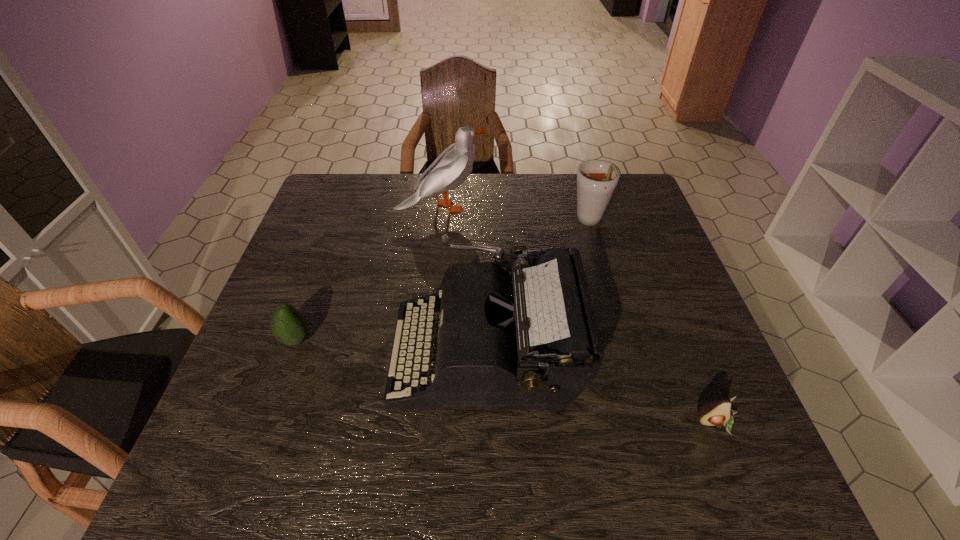
Where is `object that is the closest to the right avocado`? object that is the closest to the right avocado is located at coordinates (527, 341).